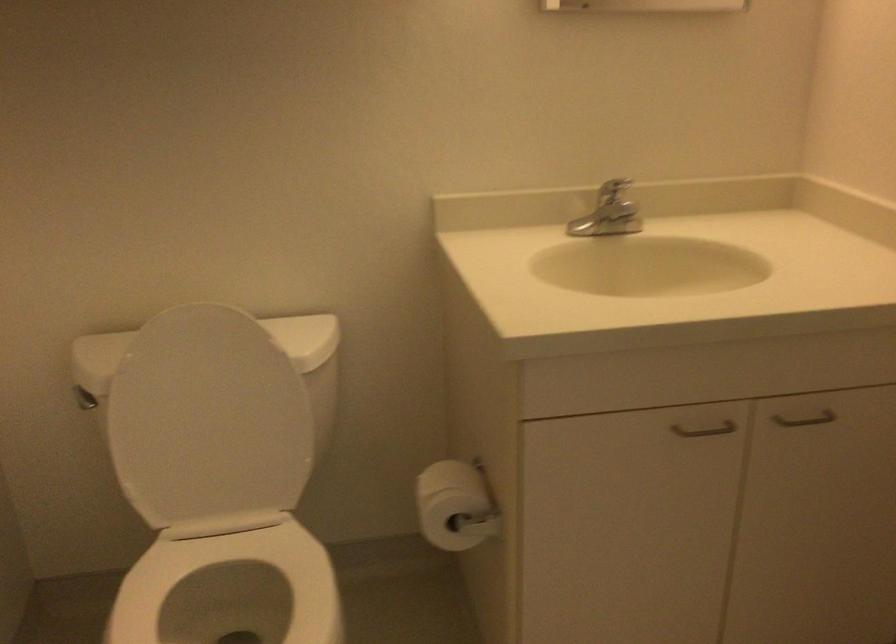
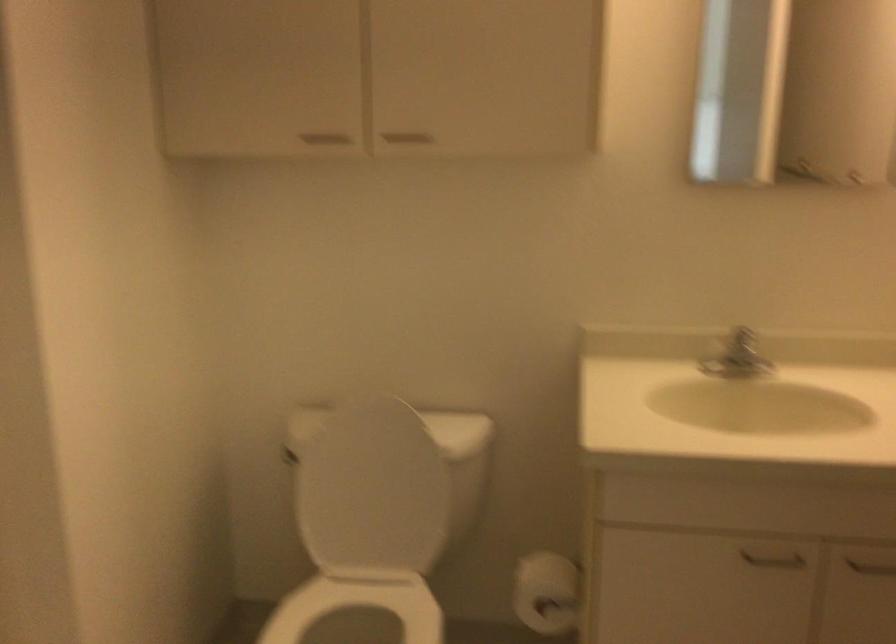
Locate, in the second image, the point that corresponds to the point at 210,426 in the first image.

(373, 491)